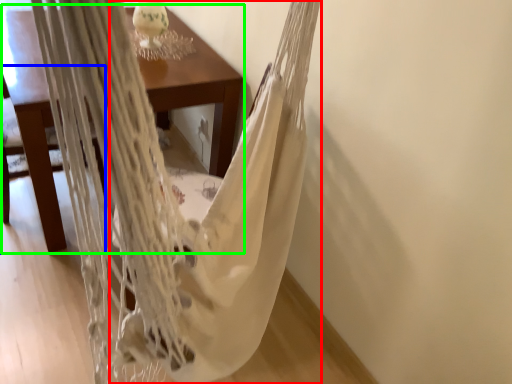
Question: Based on their relative distances, which object is nearer to blanket (highlighted by a red box)? Choose from armchair (highlighted by a blue box) and table (highlighted by a green box).

Choices:
 (A) armchair
 (B) table

Answer: (B)